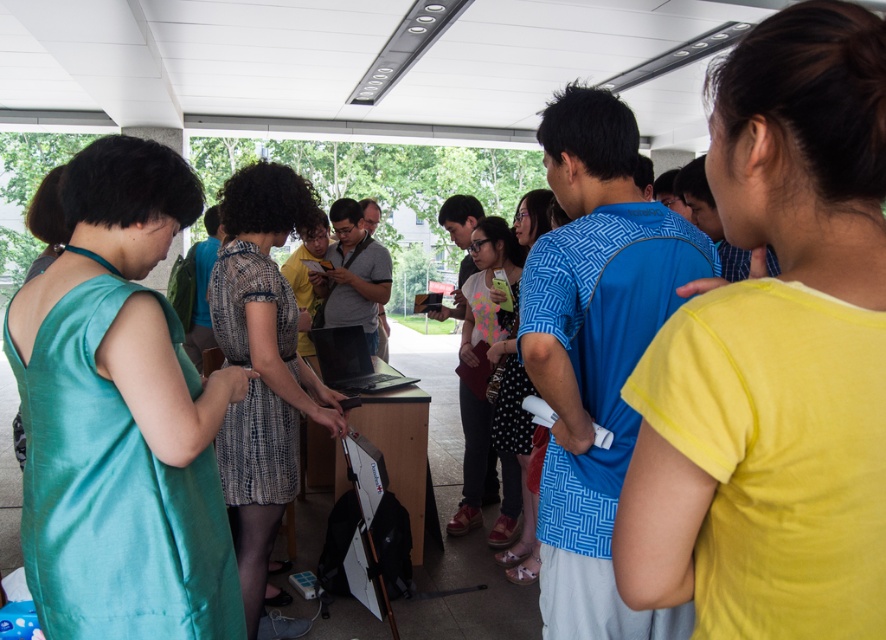
Question: Can you confirm if plaid fabric dress at center is wider than patterned fabric dress at center?

Choices:
 (A) no
 (B) yes

Answer: (B)

Question: Does yellow matte shirt at center appear on the right side of teal silk dress at left?

Choices:
 (A) no
 (B) yes

Answer: (B)

Question: Estimate the real-world distances between objects in this image. Which object is closer to the plaid fabric dress at center?

Choices:
 (A) teal silk dress at left
 (B) yellow matte shirt at center

Answer: (A)

Question: Which object is closer to the camera taking this photo?

Choices:
 (A) patterned fabric dress at center
 (B) plaid fabric dress at center
 (C) polka dot dress at center

Answer: (B)

Question: Which point is farther to the camera?

Choices:
 (A) polka dot dress at center
 (B) yellow matte shirt at center
 (C) plaid fabric dress at center
 (D) patterned fabric dress at center

Answer: (A)

Question: Is yellow matte shirt at center positioned at the back of polka dot dress at center?

Choices:
 (A) no
 (B) yes

Answer: (A)